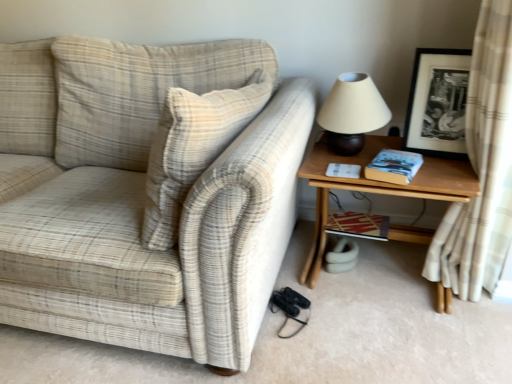
The height and width of the screenshot is (384, 512). I want to click on vacant region under wooden table at right (from a real-world perspective), so click(384, 274).